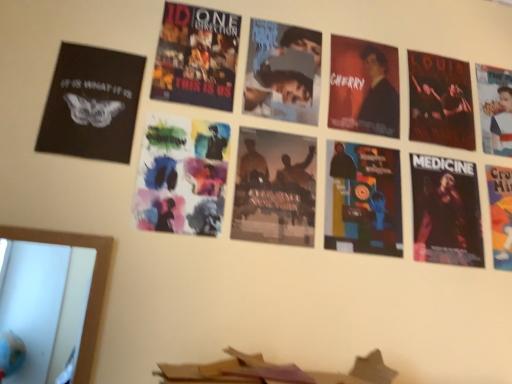
This screenshot has height=384, width=512. What do you see at coordinates (495, 109) in the screenshot?
I see `white paper poster at upper right, which is counted as the seventh poster, starting from the left` at bounding box center [495, 109].

In order to face matte black poster at center, the 4th poster when ordered from right to left, should I rotate leftwards or rightwards?

To face it directly, rotate right by 14.382 degrees.

Where is `matte black poster at center, the 4th poster when ordered from right to left`? The height and width of the screenshot is (384, 512). matte black poster at center, the 4th poster when ordered from right to left is located at coordinates (362, 199).

Describe the element at coordinates (182, 176) in the screenshot. This screenshot has height=384, width=512. I see `watercolor paper at center, the sixth poster in the right-to-left sequence` at that location.

How much space does black glossy poster at right, placed as the 5th poster when sorted from left to right, occupy horizontally?

0.51 inches.

I want to click on black glossy poster at right, placed as the 5th poster when sorted from left to right, so click(446, 211).

This screenshot has width=512, height=384. Describe the element at coordinates (275, 188) in the screenshot. I see `silvery metallic poster at center, the fifth poster viewed from the right` at that location.

Identify the location of matte black suit at upper right. The image size is (512, 384). (378, 96).

Which of these two, silvery metallic poster at center, the fifth poster viewed from the right, or white paper poster at upper right, which is counted as the seventh poster, starting from the left, is thinner?

With smaller width is white paper poster at upper right, which is counted as the seventh poster, starting from the left.

From a real-world perspective, is silvery metallic poster at center, the fifth poster viewed from the right, positioned above or below white paper poster at upper right, which is the first poster from right to left?

In terms of real-world spatial position, silvery metallic poster at center, the fifth poster viewed from the right, is below white paper poster at upper right, which is the first poster from right to left.

Can white paper poster at upper right, which is counted as the seventh poster, starting from the left, be found inside silvery metallic poster at center, the 3th poster when ordered from left to right?

That's incorrect, white paper poster at upper right, which is counted as the seventh poster, starting from the left, is not inside silvery metallic poster at center, the 3th poster when ordered from left to right.

From a real-world perspective, which poster is the 4th one above the silvery metallic poster at center, the fifth poster viewed from the right? Please provide its 2D coordinates.

[(92, 104)]

Is the position of black matte poster at upper left, arranged as the 7th poster when viewed from the right, more distant than that of silvery metallic poster at center, the 3th poster when ordered from left to right?

That is False.

Considering the relative sizes of black matte poster at upper left, which is the first poster from left to right, and silvery metallic poster at center, the 3th poster when ordered from left to right, in the image provided, is black matte poster at upper left, which is the first poster from left to right, shorter than silvery metallic poster at center, the 3th poster when ordered from left to right,?

Correct, black matte poster at upper left, which is the first poster from left to right, is not as tall as silvery metallic poster at center, the 3th poster when ordered from left to right.

From the image's perspective, between black matte poster at upper left, which is the first poster from left to right, and silvery metallic poster at center, the fifth poster viewed from the right, which one is located above?

From the image's view, black matte poster at upper left, which is the first poster from left to right, is above.

From a real-world perspective, is silvery metallic poster at center, the fifth poster viewed from the right, physically located above or below black matte poster at upper left, which is the first poster from left to right?

From a real-world perspective, silvery metallic poster at center, the fifth poster viewed from the right, is physically below black matte poster at upper left, which is the first poster from left to right.

Visually, is silvery metallic poster at center, the fifth poster viewed from the right, positioned to the left or to the right of black matte poster at upper left, which is the first poster from left to right?

silvery metallic poster at center, the fifth poster viewed from the right, is positioned on black matte poster at upper left, which is the first poster from left to right,'s right side.

Are silvery metallic poster at center, the fifth poster viewed from the right, and black matte poster at upper left, arranged as the 7th poster when viewed from the right, located far from each other?

silvery metallic poster at center, the fifth poster viewed from the right, is near black matte poster at upper left, arranged as the 7th poster when viewed from the right, not far away.

From the image's perspective, is silvery metallic poster at center, the fifth poster viewed from the right, above black matte poster at upper left, arranged as the 7th poster when viewed from the right?

No, from the image's perspective, silvery metallic poster at center, the fifth poster viewed from the right, is not over black matte poster at upper left, arranged as the 7th poster when viewed from the right.

From a real-world perspective, does black matte poster at upper left, which is the first poster from left to right, stand above watercolor paper at center, which is the 2th poster in left-to-right order?

Yes, from a real-world perspective, black matte poster at upper left, which is the first poster from left to right, is over watercolor paper at center, which is the 2th poster in left-to-right order

Which of these two, black matte poster at upper left, arranged as the 7th poster when viewed from the right, or watercolor paper at center, the sixth poster in the right-to-left sequence, is thinner?

Thinner between the two is black matte poster at upper left, arranged as the 7th poster when viewed from the right.

From a real-world perspective, is watercolor paper at center, which is the 2th poster in left-to-right order, above or below black glossy poster at right, acting as the 3th poster starting from the right?

watercolor paper at center, which is the 2th poster in left-to-right order, is above black glossy poster at right, acting as the 3th poster starting from the right.

Is watercolor paper at center, which is the 2th poster in left-to-right order, not within black glossy poster at right, placed as the 5th poster when sorted from left to right?

That's correct, watercolor paper at center, which is the 2th poster in left-to-right order, is outside of black glossy poster at right, placed as the 5th poster when sorted from left to right.

Image resolution: width=512 pixels, height=384 pixels. I want to click on the 3rd poster counting from the left side of the black glossy poster at right, acting as the 3th poster starting from the right, so click(182, 176).

Does point (175, 177) come farther from viewer compared to point (444, 252)?

No, it is not.

Is matte black poster at center, acting as the 4th poster starting from the left, positioned with its back to black matte poster at upper left, which is the first poster from left to right?

No, matte black poster at center, acting as the 4th poster starting from the left, is not facing away from black matte poster at upper left, which is the first poster from left to right.

From the image's perspective, does matte black poster at center, the 4th poster when ordered from right to left, appear lower than black matte poster at upper left, which is the first poster from left to right?

Yes, from the image's perspective, matte black poster at center, the 4th poster when ordered from right to left, is below black matte poster at upper left, which is the first poster from left to right.

Is matte black poster at center, the 4th poster when ordered from right to left, shorter than black matte poster at upper left, arranged as the 7th poster when viewed from the right?

No.

From the picture: Is matte black poster at center, acting as the 4th poster starting from the left, thinner than orange paper poster at right, which is counted as the sixth poster, starting from the left?

Yes.

Is matte black poster at center, the 4th poster when ordered from right to left, directly adjacent to orange paper poster at right, marked as the second poster in a right-to-left arrangement?

No, matte black poster at center, the 4th poster when ordered from right to left, is not making contact with orange paper poster at right, marked as the second poster in a right-to-left arrangement.

Could you tell me if matte black poster at center, acting as the 4th poster starting from the left, is turned towards orange paper poster at right, marked as the second poster in a right-to-left arrangement?

No.

Does matte black poster at center, acting as the 4th poster starting from the left, come in front of orange paper poster at right, marked as the second poster in a right-to-left arrangement?

Yes, it is.

From a real-world perspective, which poster is the 5th one underneath the white paper poster at upper right, which is the first poster from right to left? Please provide its 2D coordinates.

[(275, 188)]

Where is `the 2nd poster below the black matte poster at upper left, which is the first poster from left to right (from the image's perspective)`? This screenshot has width=512, height=384. the 2nd poster below the black matte poster at upper left, which is the first poster from left to right (from the image's perspective) is located at coordinates (275, 188).

In the scene shown: Considering their positions, is silvery metallic poster at center, the fifth poster viewed from the right, positioned closer to black glossy poster at right, placed as the 5th poster when sorted from left to right, than matte black suit at upper right?

matte black suit at upper right lies closer to black glossy poster at right, placed as the 5th poster when sorted from left to right, than the other object.

Which object lies further to the anchor point white paper poster at upper right, which is counted as the seventh poster, starting from the left, black glossy poster at right, placed as the 5th poster when sorted from left to right, or matte black poster at center, acting as the 4th poster starting from the left?

matte black poster at center, acting as the 4th poster starting from the left, is further to white paper poster at upper right, which is counted as the seventh poster, starting from the left.

Estimate the real-world distances between objects in this image. Which object is further from silvery metallic poster at center, the 3th poster when ordered from left to right, matte black poster at center, the 4th poster when ordered from right to left, or orange paper poster at right, marked as the second poster in a right-to-left arrangement?

orange paper poster at right, marked as the second poster in a right-to-left arrangement.

From the picture: Based on their spatial positions, is black matte poster at upper left, which is the first poster from left to right, or white paper poster at upper right, which is the first poster from right to left, further from black glossy poster at right, placed as the 5th poster when sorted from left to right?

black matte poster at upper left, which is the first poster from left to right, lies further to black glossy poster at right, placed as the 5th poster when sorted from left to right, than the other object.

Considering their positions, is matte black suit at upper right positioned closer to black glossy poster at right, acting as the 3th poster starting from the right, than black matte poster at upper left, arranged as the 7th poster when viewed from the right?

matte black suit at upper right.

Considering their positions, is white paper poster at upper right, which is the first poster from right to left, positioned closer to matte black suit at upper right than matte black poster at center, acting as the 4th poster starting from the left?

matte black poster at center, acting as the 4th poster starting from the left, is positioned closer to the anchor matte black suit at upper right.

Considering their positions, is watercolor paper at center, which is the 2th poster in left-to-right order, positioned closer to matte black suit at upper right than orange paper poster at right, marked as the second poster in a right-to-left arrangement?

orange paper poster at right, marked as the second poster in a right-to-left arrangement, lies closer to matte black suit at upper right than the other object.

When comparing their distances from matte black suit at upper right, does watercolor paper at center, which is the 2th poster in left-to-right order, or black glossy poster at right, acting as the 3th poster starting from the right, seem closer?

black glossy poster at right, acting as the 3th poster starting from the right, is closer to matte black suit at upper right.

Locate an element on the screen. The width and height of the screenshot is (512, 384). poster situated between watercolor paper at center, which is the 2th poster in left-to-right order, and matte black poster at center, the 4th poster when ordered from right to left, from left to right is located at coordinates (275, 188).

I want to click on person located between black matte poster at upper left, arranged as the 7th poster when viewed from the right, and orange paper poster at right, which is counted as the sixth poster, starting from the left, in the left-right direction, so click(x=378, y=96).

This screenshot has width=512, height=384. Identify the location of person located between silvery metallic poster at center, the fifth poster viewed from the right, and black glossy poster at right, acting as the 3th poster starting from the right, in the left-right direction. (378, 96).

This screenshot has height=384, width=512. I want to click on person between watercolor paper at center, which is the 2th poster in left-to-right order, and orange paper poster at right, marked as the second poster in a right-to-left arrangement, so click(378, 96).